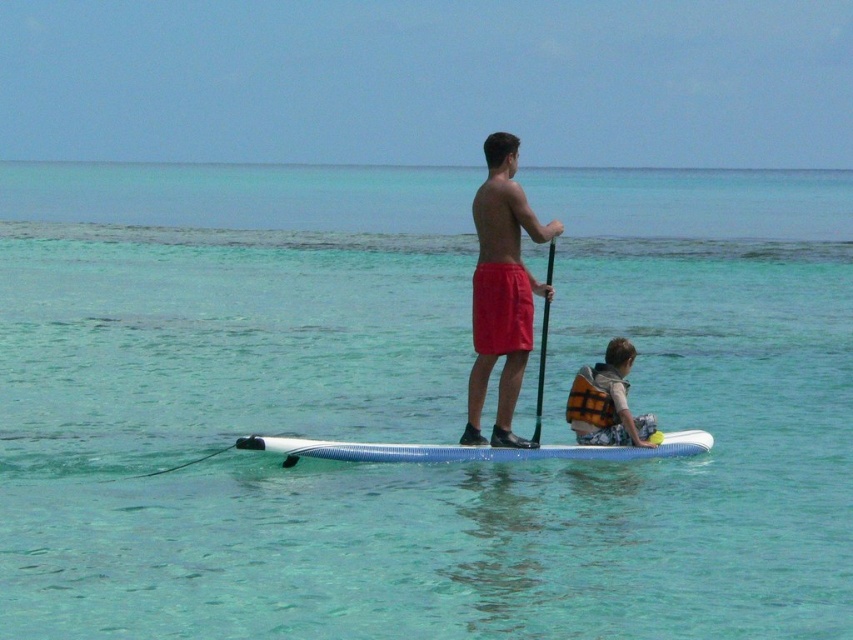
Question: Does white glossy surfboard at center appear under orange life vest at center?

Choices:
 (A) yes
 (B) no

Answer: (A)

Question: Which point is farther from the camera taking this photo?

Choices:
 (A) (339, 442)
 (B) (610, 368)

Answer: (B)

Question: Among these objects, which one is farthest from the camera?

Choices:
 (A) clear blue water at center
 (B) matte red shorts at center
 (C) black rubber paddle at center
 (D) white glossy surfboard at center

Answer: (C)

Question: Which point is farther from the camera taking this photo?

Choices:
 (A) (538, 426)
 (B) (619, 348)
 (C) (427, 460)

Answer: (B)

Question: From the image, what is the correct spatial relationship of orange life vest at center in relation to black rubber paddle at center?

Choices:
 (A) below
 (B) above

Answer: (A)

Question: Can you confirm if matte red shorts at center is bigger than orange life vest at center?

Choices:
 (A) no
 (B) yes

Answer: (B)